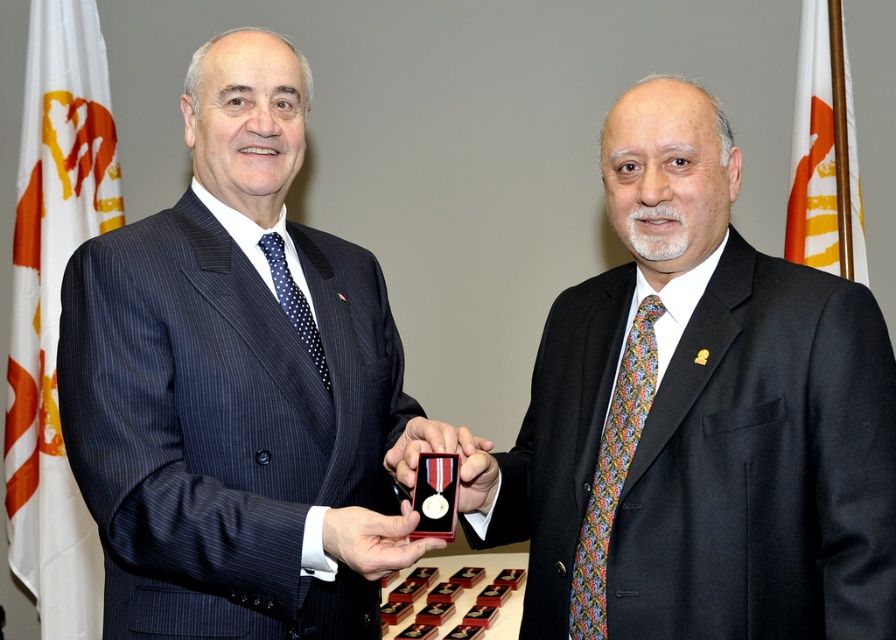
You are a photographer standing in front of the two men. You want to take a photo of the matte black suit at center without the white fabric flag at upper right appearing in the background. Is this possible based on their current positions?

The matte black suit at center is in front of the white fabric flag at upper right, so if you position yourself so that the matte black suit at center blocks the view of the white fabric flag at upper right, you can take the photo without the flag appearing in the background.

You are a photographer setting up for a formal event. You need to ensure that the matte black suit at center and the blue dotted tie at left are visible in your frame. Given their sizes, which object should you focus on first to ensure proper framing?

The matte black suit at center is wider than the blue dotted tie at left, so you should focus on the matte black suit at center first to ensure proper framing.

You are a photographer who needs to adjust the lighting to highlight the multicolored woven tie at right. Based on their positions, which man should you focus on to ensure the tie is properly lit?

The multicolored woven tie at right is located on the man on the right, so you should focus on him to ensure the tie is properly lit.